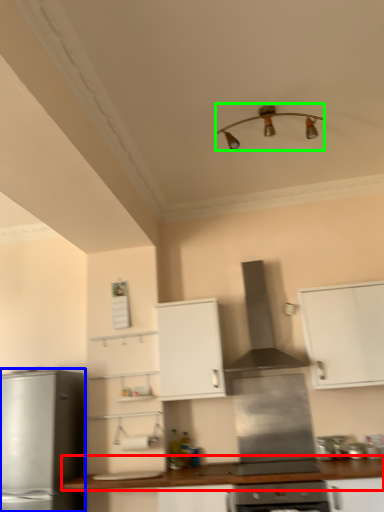
Question: Based on their relative distances, which object is farther from countertop (highlighted by a red box)? Choose from kitchen appliance (highlighted by a blue box) and light fixture (highlighted by a green box).

Choices:
 (A) kitchen appliance
 (B) light fixture

Answer: (B)